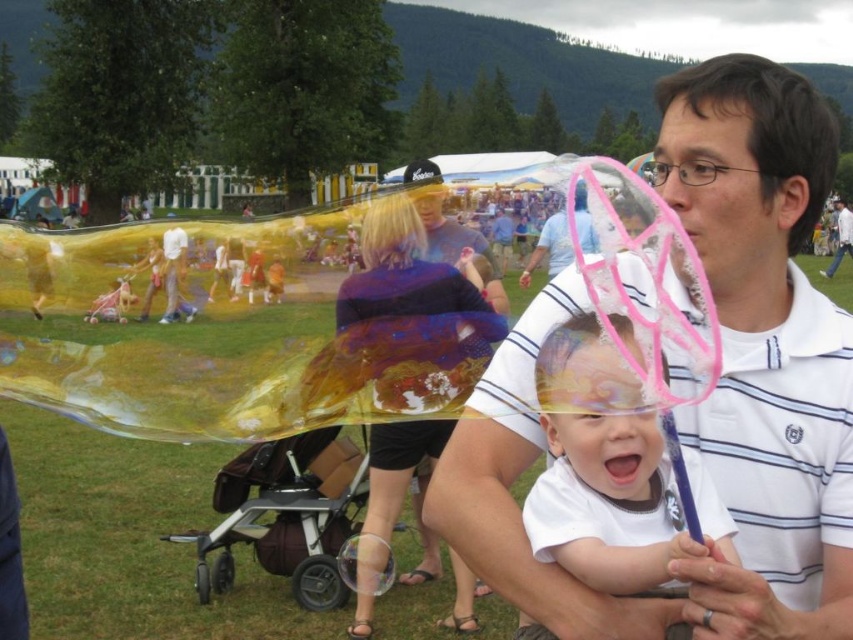
You are a photographer at the event and want to capture a photo that includes both the brown fabric stroller at lower center and the matte blue shirt at center. Based on their positions, which object should you place on the left side of your photo?

The brown fabric stroller at lower center should be placed on the left side of your photo since it is located to the left of the matte blue shirt at center.

You are standing at the point with coordinates point (215, 480) and want to walk to the point with coordinates point (554, 413). Which direction should you move in to get closer to your destination?

To move from point (215, 480) to point (554, 413), you should move upward and to the left because point (554, 413) is closer to the viewer than point (215, 480).

You are a photographer trying to capture a photo of the brown fabric stroller at lower center and the matte blue shirt at center. Based on their height, which object should you focus on first to ensure both are in frame?

The brown fabric stroller at lower center is much taller than the matte blue shirt at center, so you should focus on the brown fabric stroller at lower center first to ensure both are in frame.